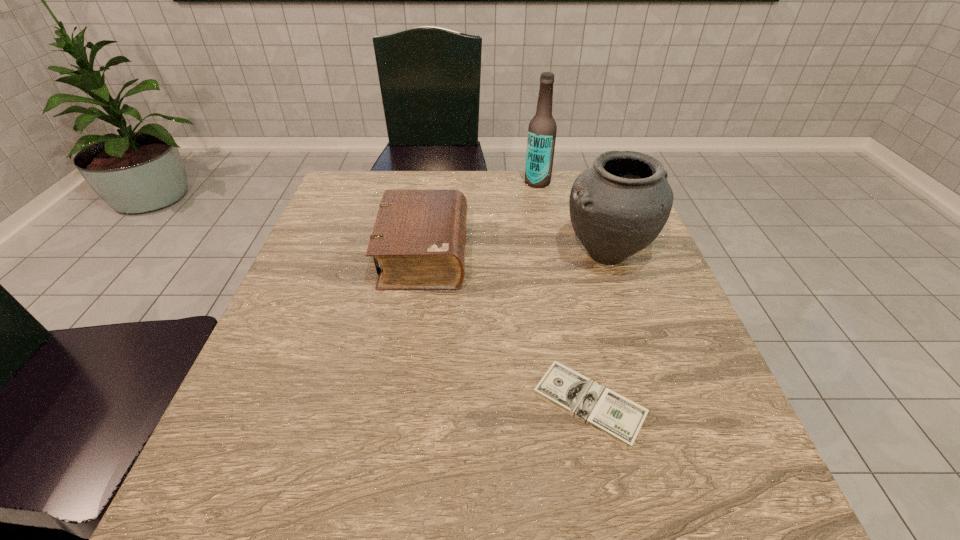
Locate an element on the screen. This screenshot has height=540, width=960. the tallest object is located at coordinates (542, 129).

The height and width of the screenshot is (540, 960). Find the location of `the farthest object`. the farthest object is located at coordinates (542, 129).

Locate an element on the screen. the third shortest object is located at coordinates (618, 206).

Locate an element on the screen. This screenshot has width=960, height=540. the leftmost object is located at coordinates (419, 237).

Identify the location of the second shortest object. The image size is (960, 540). point(419,237).

Identify the location of the shortest object. (615, 416).

The height and width of the screenshot is (540, 960). What are the coordinates of `dollar` in the screenshot? It's located at (615, 416).

Image resolution: width=960 pixels, height=540 pixels. I want to click on free space located 0.360m on the label of the beer bottle, so click(397, 182).

Locate an element on the screen. The width and height of the screenshot is (960, 540). free region located on the label of the beer bottle is located at coordinates (486, 182).

The height and width of the screenshot is (540, 960). Find the location of `vacant space located on the label of the beer bottle`. vacant space located on the label of the beer bottle is located at coordinates (429, 182).